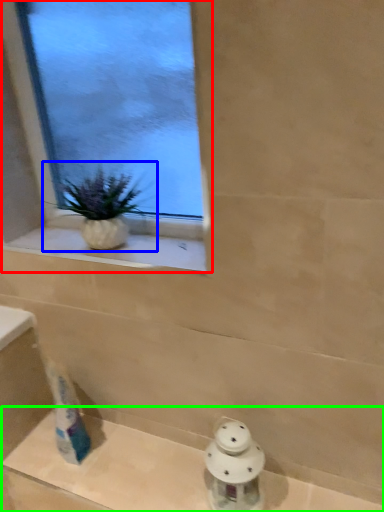
Question: Which is farther away from window (highlighted by a red box)? houseplant (highlighted by a blue box) or bath (highlighted by a green box)?

Choices:
 (A) houseplant
 (B) bath

Answer: (B)